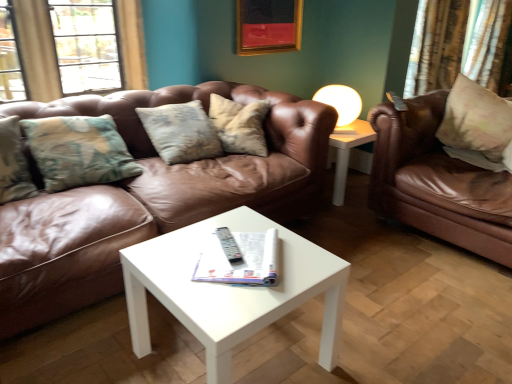
You are a GUI agent. You are given a task and a screenshot of the screen. Output one action in this format:
    pyautogui.click(x=<x>, y=<y>)
    Task: Click on the free space that is to the left of white paper magazine at center
    The image size is (512, 384).
    Given the screenshot: What is the action you would take?
    pyautogui.click(x=169, y=256)